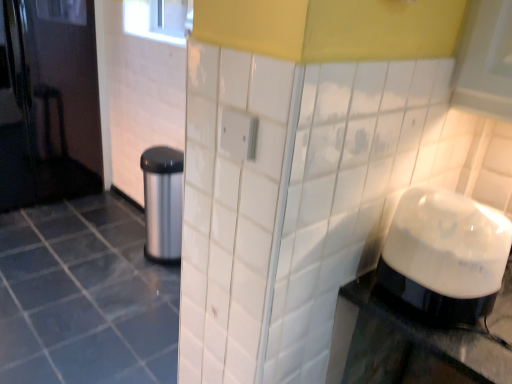
The image size is (512, 384). What are the coordinates of `satin silver trash can at left` in the screenshot? It's located at (163, 203).

Does satin silver trash can at left turn towards white glossy blender at right?

No, satin silver trash can at left is not oriented towards white glossy blender at right.

Is satin silver trash can at left positioned in front of white glossy blender at right?

No, satin silver trash can at left is further to the viewer.

Measure the distance from satin silver trash can at left to white glossy blender at right.

satin silver trash can at left and white glossy blender at right are 5.13 feet apart from each other.

From the picture: From a real-world perspective, relative to white glossy tile at center, is satin silver trash can at left vertically above or below?

Clearly, from a real-world perspective, satin silver trash can at left is above white glossy tile at center.

Are satin silver trash can at left and white glossy tile at center located far from each other?

No, satin silver trash can at left is not far away from white glossy tile at center.

Is satin silver trash can at left smaller than white glossy tile at center?

Yes.

Is satin silver trash can at left to the left of white glossy tile at center from the viewer's perspective?

No.

From a real-world perspective, is white glossy tile at center physically below satin silver trash can at left?

Yes, from a real-world perspective, white glossy tile at center is below satin silver trash can at left.

Is white glossy tile at center inside the boundaries of satin silver trash can at left, or outside?

white glossy tile at center is outside satin silver trash can at left.

Are white glossy tile at center and satin silver trash can at left located far from each other?

No.

Is the position of white glossy tile at center more distant than that of satin silver trash can at left?

No, white glossy tile at center is in front of satin silver trash can at left.

From a real-world perspective, relative to white glossy blender at right, is white glossy tile at center vertically above or below?

Clearly, from a real-world perspective, white glossy tile at center is below white glossy blender at right.

Considering the positions of point (103, 202) and point (506, 243), is point (103, 202) closer or farther from the camera than point (506, 243)?

Point (103, 202).

Based on their positions, is white glossy tile at center located to the left or right of white glossy blender at right?

From the image, it's evident that white glossy tile at center is to the left of white glossy blender at right.

This screenshot has width=512, height=384. I want to click on ceramic tile that is under the white glossy blender at right (from a real-world perspective), so click(x=84, y=297).

Does white glossy blender at right turn towards white glossy tile at center?

No, white glossy blender at right is not facing towards white glossy tile at center.

From a real-world perspective, between white glossy blender at right and white glossy tile at center, who is vertically lower?

In real-world perspective, white glossy tile at center is lower.

From the image's perspective, does white glossy blender at right appear lower than white glossy tile at center?

Actually, white glossy blender at right appears above white glossy tile at center in the image.

From a real-world perspective, is white glossy blender at right above or below satin silver trash can at left?

white glossy blender at right is situated higher than satin silver trash can at left in the real world.

Which object is further away from the camera taking this photo, white glossy blender at right or satin silver trash can at left?

Positioned behind is satin silver trash can at left.

Does point (411, 255) lie in front of point (152, 150)?

Yes, it is.

Is white glossy blender at right facing towards satin silver trash can at left?

No, white glossy blender at right does not turn towards satin silver trash can at left.

At what (x,y) coordinates should I click in order to perform the action: click on blender located below the satin silver trash can at left (from the image's perspective). Please return your answer as a coordinate pair (x, y). Looking at the image, I should click on pos(443,255).

This screenshot has width=512, height=384. I want to click on appliance that is behind the white glossy tile at center, so click(163, 203).

From the picture: Considering their positions, is white glossy tile at center positioned closer to white glossy blender at right than satin silver trash can at left?

Based on the image, white glossy tile at center appears to be nearer to white glossy blender at right.

Estimate the real-world distances between objects in this image. Which object is further from satin silver trash can at left, white glossy blender at right or white glossy tile at center?

The object further to satin silver trash can at left is white glossy blender at right.

From the image, which object appears to be farther from white glossy tile at center, satin silver trash can at left or white glossy blender at right?

white glossy blender at right lies further to white glossy tile at center than the other object.

Which object lies nearer to the anchor point white glossy tile at center, white glossy blender at right or satin silver trash can at left?

Among the two, satin silver trash can at left is located nearer to white glossy tile at center.

Considering their positions, is satin silver trash can at left positioned further to white glossy blender at right than white glossy tile at center?

Based on the image, satin silver trash can at left appears to be further to white glossy blender at right.

From the image, which object appears to be nearer to satin silver trash can at left, white glossy tile at center or white glossy blender at right?

Among the two, white glossy tile at center is located nearer to satin silver trash can at left.

You are a GUI agent. You are given a task and a screenshot of the screen. Output one action in this format:
    pyautogui.click(x=<x>, y=<y>)
    Task: Click on the ceramic tile located between white glossy blender at right and satin silver trash can at left in the depth direction
    The width and height of the screenshot is (512, 384).
    Given the screenshot: What is the action you would take?
    pyautogui.click(x=84, y=297)